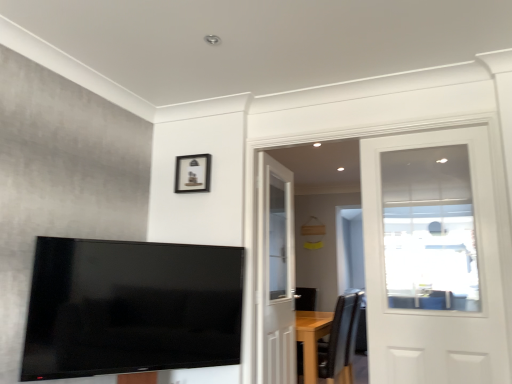
Question: Looking at their shapes, would you say matte black picture frame at upper center is wider or thinner than white wooden door at center, positioned as the 2th door in front-to-back order?

Choices:
 (A) wide
 (B) thin

Answer: (B)

Question: From the image's perspective, is matte black picture frame at upper center located above or below white wooden door at center, which is counted as the 1th door, starting from the back?

Choices:
 (A) below
 (B) above

Answer: (B)

Question: Which is farther from the black leather chair at lower right?

Choices:
 (A) white glossy door at upper right, which is the 1th door from front to back
 (B) flat screen tv at lower left
 (C) matte black picture frame at upper center
 (D) white wooden door at center, which is counted as the first door, starting from the left

Answer: (A)

Question: Which object is the farthest from the white wooden door at center, which is counted as the first door, starting from the left?

Choices:
 (A) matte black picture frame at upper center
 (B) white glossy door at upper right, the second door when ordered from left to right
 (C) black leather chair at lower right
 (D) flat screen tv at lower left

Answer: (B)